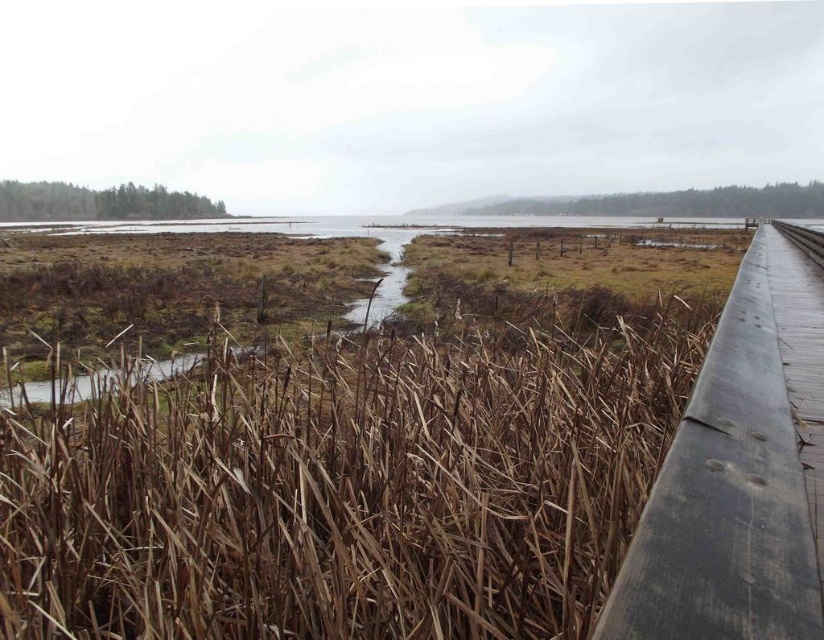
Based on the photo, does wooden rail at right appear on the left side of wooden at right?

Indeed, wooden rail at right is positioned on the left side of wooden at right.

Which is above, wooden rail at right or wooden at right?

Positioned higher is wooden at right.

Which is behind, point (761, 627) or point (780, 221)?

The point (780, 221) is behind.

Find the location of a particular element. The height and width of the screenshot is (640, 824). wooden rail at right is located at coordinates (738, 476).

Does brown dry reed at lower right have a greater width compared to wooden at right?

Incorrect, brown dry reed at lower right's width does not surpass wooden at right's.

Measure the distance between point (x=96, y=481) and camera.

2.43 meters

You are a GUI agent. You are given a task and a screenshot of the screen. Output one action in this format:
    pyautogui.click(x=<x>, y=<y>)
    Task: Click on the brown dry reed at lower right
    
    Given the screenshot: What is the action you would take?
    (x=349, y=486)

Where is `brown dry reed at lower right`? brown dry reed at lower right is located at coordinates (349, 486).

Describe the element at coordinates (349, 486) in the screenshot. The height and width of the screenshot is (640, 824). I see `brown dry reed at lower right` at that location.

From the picture: Does brown dry reed at lower right have a lesser width compared to wooden rail at right?

Correct, brown dry reed at lower right's width is less than wooden rail at right's.

Locate an element on the screen. Image resolution: width=824 pixels, height=640 pixels. brown dry reed at lower right is located at coordinates (349, 486).